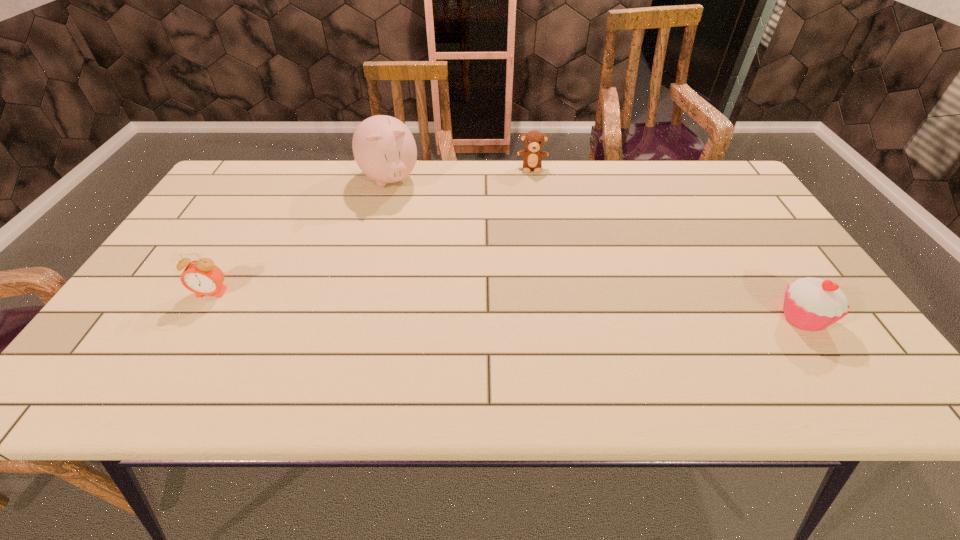
Where is `vacant spot on the desktop that is between the leftmost object and the cupcake and is positioned on the face of the teddy bear`? vacant spot on the desktop that is between the leftmost object and the cupcake and is positioned on the face of the teddy bear is located at coordinates (537, 307).

Identify the location of free space on the desktop that is between the leftmost object and the rightmost object and is positioned at the snout of the tallest object. Image resolution: width=960 pixels, height=540 pixels. (454, 303).